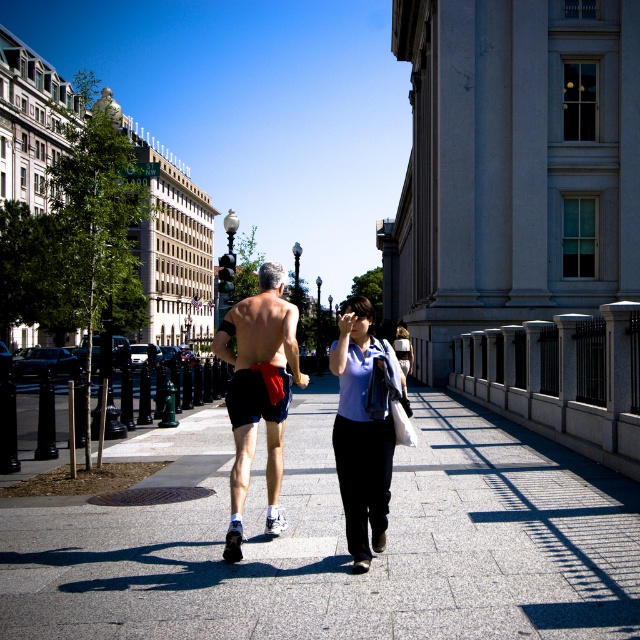
From the picture: You are a delivery robot positioned at the point marked by the coordinates point (339,540). You need to reach the paved stone sidewalk at center. Is your current position already on the paved stone sidewalk at center?

Yes, because the paved stone sidewalk at center is located at point (339,540), which is exactly where you are positioned.

From the picture: You are a photographer standing on the sidewalk and want to take a photo of both the matte black shorts at center and the dark blue shorts at center. The minimum distance between the two subjects for your camera to focus on both clearly is 34 inches. Can you capture both in focus without moving the camera?

The matte black shorts at center and dark blue shorts at center are 33.34 inches apart, which is less than the required 34 inches. Therefore, you cannot capture both in focus without moving the camera.

You are a delivery person on a bicycle that is 1.5 meters wide. You need to pass between the paved stone sidewalk at center and the dark blue shorts at center. Is there enough space for your bicycle to fit through?

The paved stone sidewalk at center and dark blue shorts at center are 4.33 meters apart. Since your bicycle is 1.5 meters wide, there is sufficient space to pass through as 4.33 meters is wider than 1.5 meters.